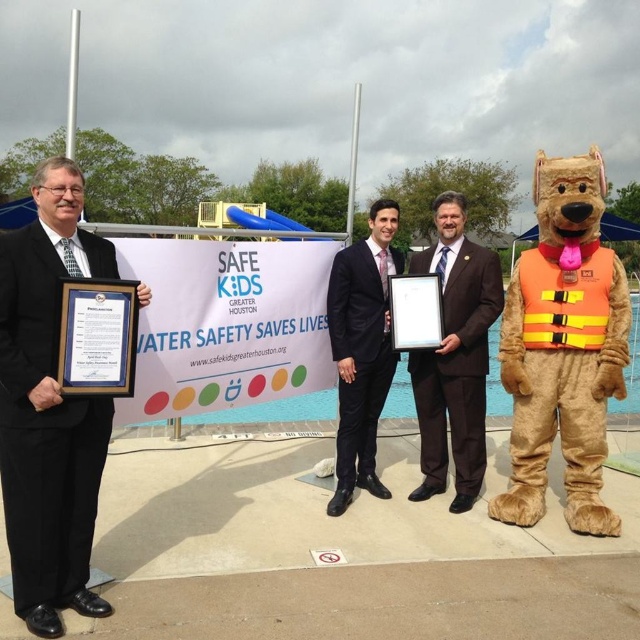
I want to click on brown suit at center, so click(454, 356).

How far apart are brown suit at center and black suit at center?

15.98 inches

Does point (481, 467) come farther from viewer compared to point (372, 301)?

Yes.

Identify the location of brown suit at center. (454, 356).

Can you confirm if black matte suit at left is smaller than fuzzy brown teddy bear at right?

Correct, black matte suit at left occupies less space than fuzzy brown teddy bear at right.

Identify the location of black matte suit at left. Image resolution: width=640 pixels, height=640 pixels. (49, 408).

Between point (49, 160) and point (545, 397), which one is positioned behind?

The point (545, 397) is behind.

Find the location of a particular element. The height and width of the screenshot is (640, 640). black matte suit at left is located at coordinates (49, 408).

Can you confirm if fuzzy brown teddy bear at right is shorter than brown suit at center?

Incorrect, fuzzy brown teddy bear at right's height does not fall short of brown suit at center's.

Does fuzzy brown teddy bear at right have a greater width compared to brown suit at center?

Yes.

Where is `fuzzy brown teddy bear at right`? fuzzy brown teddy bear at right is located at coordinates (563, 348).